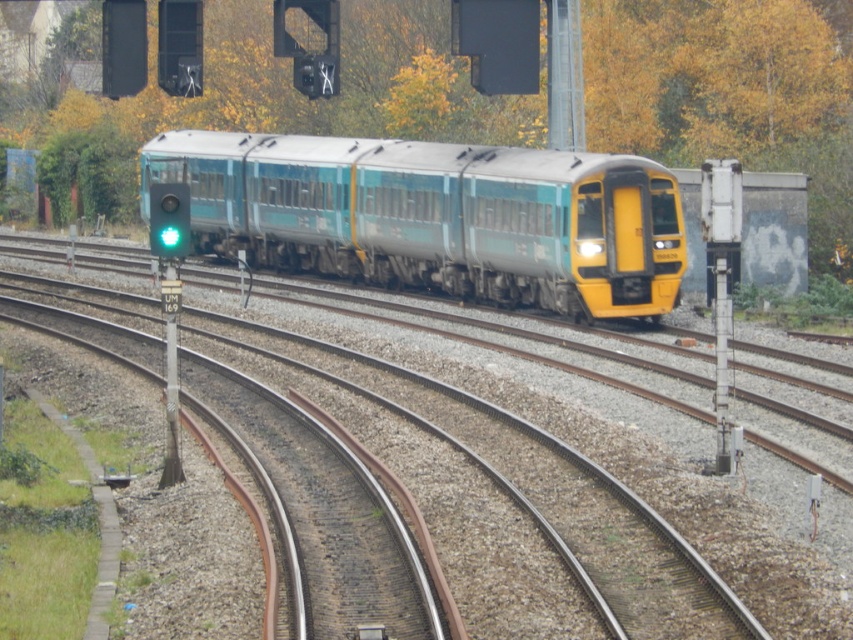
Question: Considering the relative positions of teal/grey metallic train at center and green glass traffic light at left in the image provided, where is teal/grey metallic train at center located with respect to green glass traffic light at left?

Choices:
 (A) left
 (B) right

Answer: (B)

Question: Estimate the real-world distances between objects in this image. Which object is farther from the green glass traffic light at left?

Choices:
 (A) yellow-green leaves at upper center
 (B) teal/grey metallic train at center

Answer: (A)

Question: Can you confirm if teal/grey metallic train at center is wider than green glass traffic light at left?

Choices:
 (A) no
 (B) yes

Answer: (B)

Question: Among these objects, which one is farthest from the camera?

Choices:
 (A) teal/grey metallic train at center
 (B) green glass traffic light at left
 (C) yellow-green leaves at upper center

Answer: (C)

Question: Among these points, which one is nearest to the camera?

Choices:
 (A) (183, 236)
 (B) (434, 77)

Answer: (A)

Question: Does yellow-green leaves at upper center have a larger size compared to teal/grey metallic train at center?

Choices:
 (A) yes
 (B) no

Answer: (A)